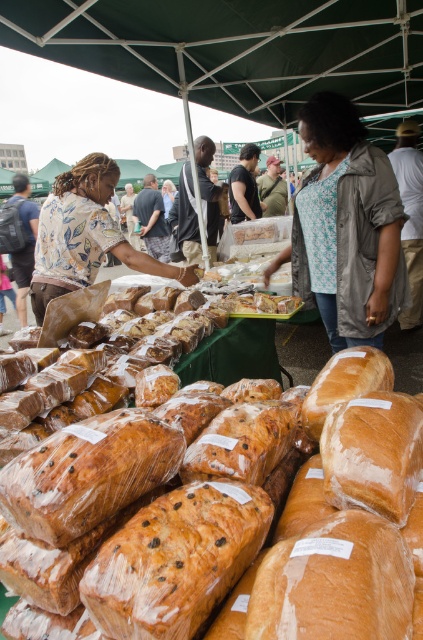
Question: Which object appears closest to the camera in this image?

Choices:
 (A) floral shirt at left
 (B) floral shirt at center

Answer: (B)

Question: Which of these objects is positioned closest to the smooth beige skin at center?

Choices:
 (A) floral-patterned shirt at center
 (B) camouflage-patterned shirt at center
 (C) dark gray shirt at center
 (D) floral shirt at left

Answer: (B)

Question: Can you confirm if floral-patterned shirt at center is wider than floral shirt at center?

Choices:
 (A) yes
 (B) no

Answer: (B)

Question: Can you confirm if floral-patterned shirt at center is thinner than dark brown leather jacket at center?

Choices:
 (A) no
 (B) yes

Answer: (A)

Question: Is floral-patterned shirt at center to the right of dark brown leather jacket at center from the viewer's perspective?

Choices:
 (A) yes
 (B) no

Answer: (A)

Question: Which object is the farthest from the smooth beige skin at center?

Choices:
 (A) green fabric canopy at upper center
 (B) dark gray shirt at center
 (C) golden brown loaf at center
 (D) floral-patterned shirt at center

Answer: (C)